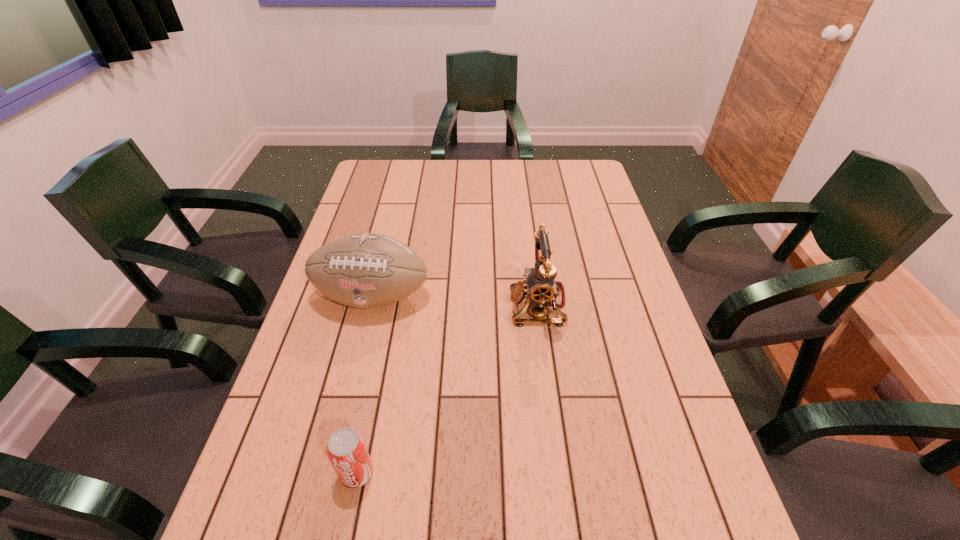
At what (x,y) coordinates should I click in order to perform the action: click on free space between the shortest object and the football (American). Please return your answer as a coordinate pair (x, y). This screenshot has width=960, height=540. Looking at the image, I should click on (365, 385).

You are a GUI agent. You are given a task and a screenshot of the screen. Output one action in this format:
    pyautogui.click(x=<x>, y=<y>)
    Task: Click on the free space between the football (American) and the soda can
    
    Given the screenshot: What is the action you would take?
    pyautogui.click(x=365, y=385)

This screenshot has height=540, width=960. In order to click on the second closest object to the nearest object in this screenshot , I will do `click(540, 286)`.

Select which object is the second closest to the telephone. Please provide its 2D coordinates. Your answer should be formatted as a tuple, i.e. [(x, y)], where the tuple contains the x and y coordinates of a point satisfying the conditions above.

[(346, 449)]

The width and height of the screenshot is (960, 540). In order to click on free spot that satisfies the following two spatial constraints: 1. on the front of the tallest object, featuring the rotary dial; 2. on the logo side of the soda can in this screenshot , I will do `click(560, 473)`.